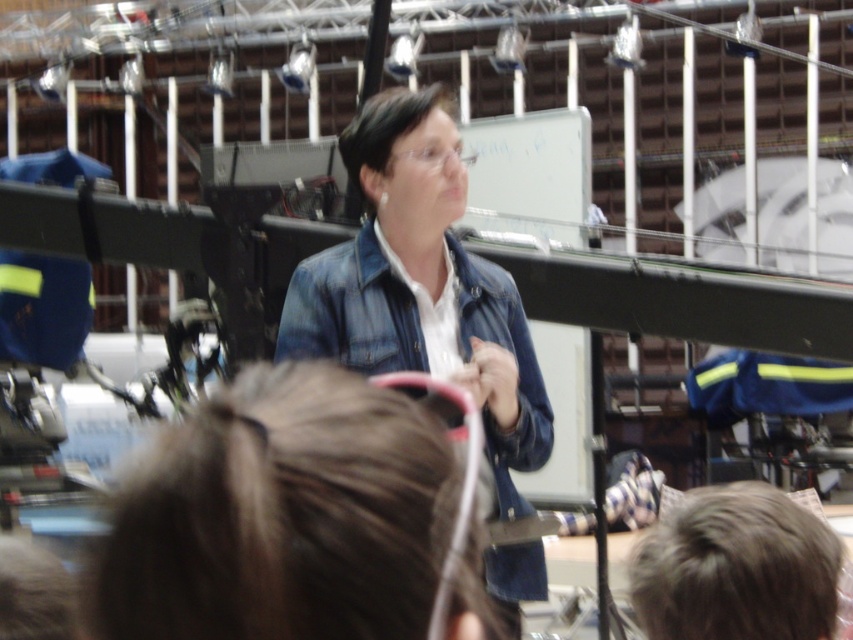
What are the coordinates of the brown straight hair at center?

The coordinates of the brown straight hair at center are at point (280, 515).

You are a photographer trying to capture a clear shot of the person speaking at the front. However, you notice two hair strands in the frame. Which hair strand, the brown straight hair at center or the brown matte hair at lower right, is closer to the camera?

The brown straight hair at center is closer to the camera because it is positioned over the brown matte hair at lower right.

You are an observer in the scene. You notice the denim jacket at center and the dark brown hair at center. Which object is bigger in size?

The denim jacket at center is larger in size than the dark brown hair at center.